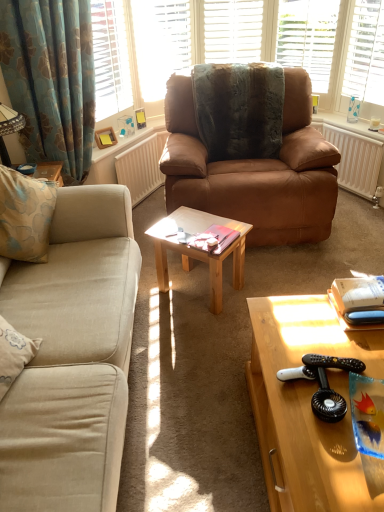
The image size is (384, 512). Find the location of `unoccupied area behind matte pink book at center`. unoccupied area behind matte pink book at center is located at coordinates click(x=214, y=221).